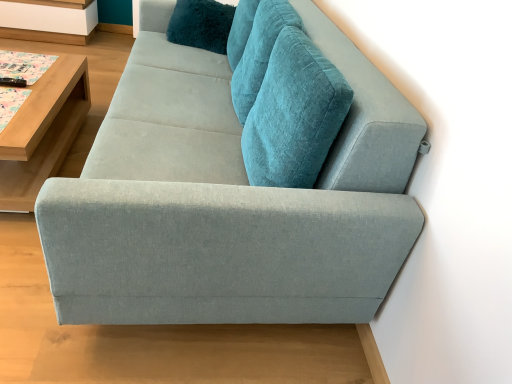
Question: Based on their sizes in the image, would you say white wood shelf at upper left is bigger or smaller than light wood/wooden table at left?

Choices:
 (A) small
 (B) big

Answer: (A)

Question: Is white wood shelf at upper left in front of or behind light wood/wooden table at left in the image?

Choices:
 (A) behind
 (B) front

Answer: (A)

Question: Based on their relative distances, which object is nearer to the light wood/wooden table at left?

Choices:
 (A) teal plush pillow at upper center
 (B) light gray fabric couch at center
 (C) white wood shelf at upper left

Answer: (A)

Question: Which object is positioned closest to the light wood/wooden table at left?

Choices:
 (A) white wood shelf at upper left
 (B) light gray fabric couch at center
 (C) teal plush pillow at upper center

Answer: (C)